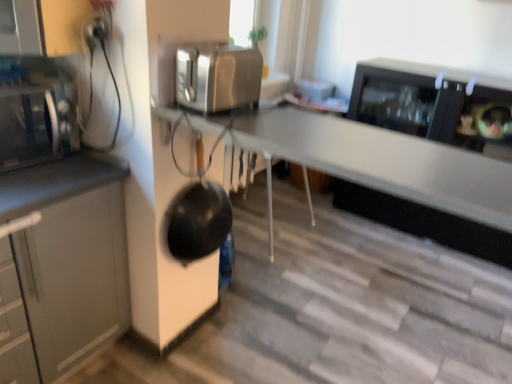
Find the location of `vacant area in front of satin silver toaster at upper center`. vacant area in front of satin silver toaster at upper center is located at coordinates (247, 130).